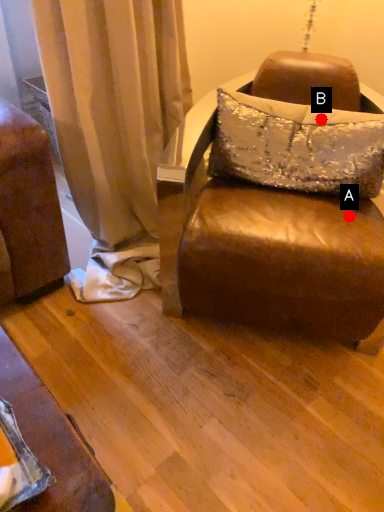
Question: Two points are circled on the image, labeled by A and B beside each circle. Which point appears farthest from the camera in this image?

Choices:
 (A) A is further
 (B) B is further

Answer: (B)